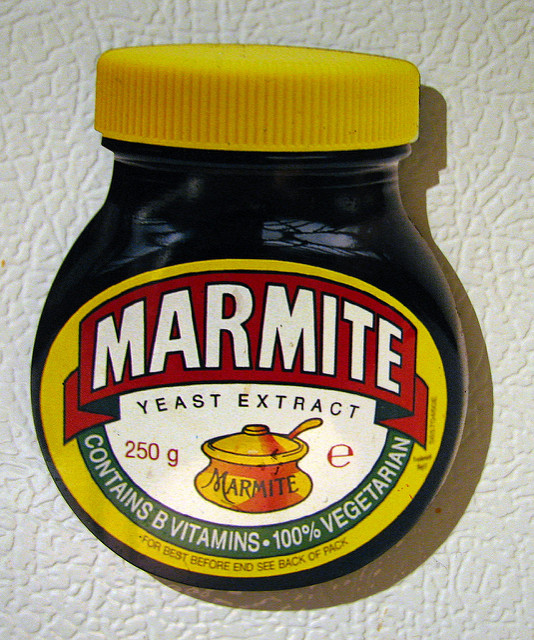
You are a GUI agent. You are given a task and a screenshot of the screen. Output one action in this format:
    pyautogui.click(x=<x>, y=<y>)
    Task: Click on the white textured refrigerator surface
    The image size is (534, 640).
    Given the screenshot: What is the action you would take?
    pyautogui.click(x=466, y=584), pyautogui.click(x=26, y=198)